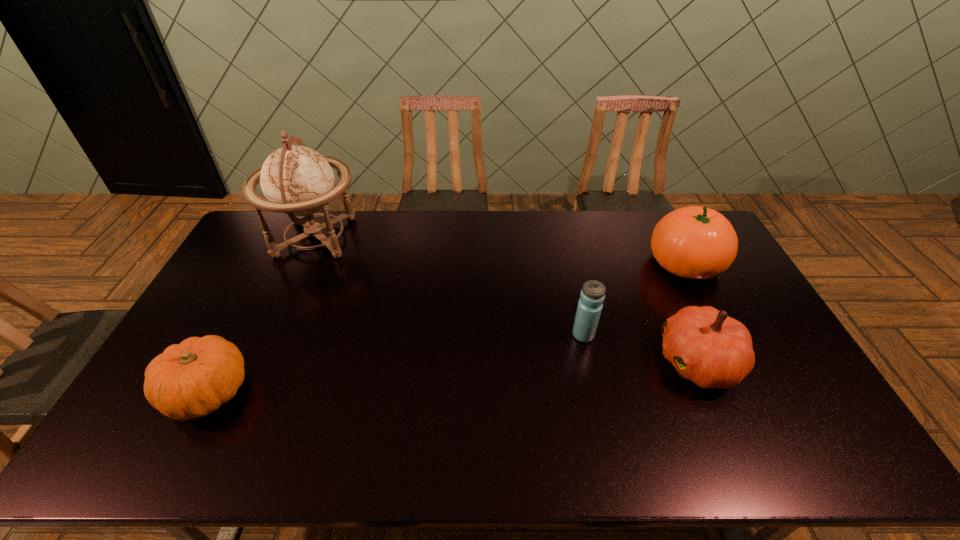
This screenshot has height=540, width=960. In order to click on object that stands as the closest to the tallest object in this screenshot , I will do `click(192, 379)`.

Identify which object is the nearest to the farthest pumpkin. Please provide its 2D coordinates. Your answer should be formatted as a tuple, i.e. [(x, y)], where the tuple contains the x and y coordinates of a point satisfying the conditions above.

[(706, 346)]

Where is `the third closest pumpkin relative to the globe`? This screenshot has width=960, height=540. the third closest pumpkin relative to the globe is located at coordinates (694, 242).

Locate an element on the screen. pumpkin object that ranks as the third closest to the third object from right to left is located at coordinates (192, 379).

The width and height of the screenshot is (960, 540). Find the location of `vacant position in the image that satisfies the following two spatial constraints: 1. at the front of the globe showing Africa; 2. on the back side of the third object from left to right`. vacant position in the image that satisfies the following two spatial constraints: 1. at the front of the globe showing Africa; 2. on the back side of the third object from left to right is located at coordinates (273, 335).

Identify the location of vacant area in the image that satisfies the following two spatial constraints: 1. at the front of the third object from left to right showing Africa; 2. on the right side of the tallest object. (273, 335).

Locate an element on the screen. The image size is (960, 540). free space that satisfies the following two spatial constraints: 1. at the front of the third object from left to right showing Africa; 2. on the left side of the globe is located at coordinates (273, 335).

Find the location of a particular element. This screenshot has width=960, height=540. free space in the image that satisfies the following two spatial constraints: 1. at the front of the tallest object showing Africa; 2. on the right side of the third object from left to right is located at coordinates (273, 335).